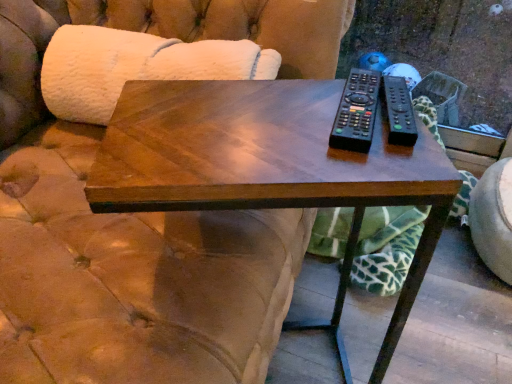
Identify the location of free location above shiny wood coffee table at center (from a real-world perspective). (266, 124).